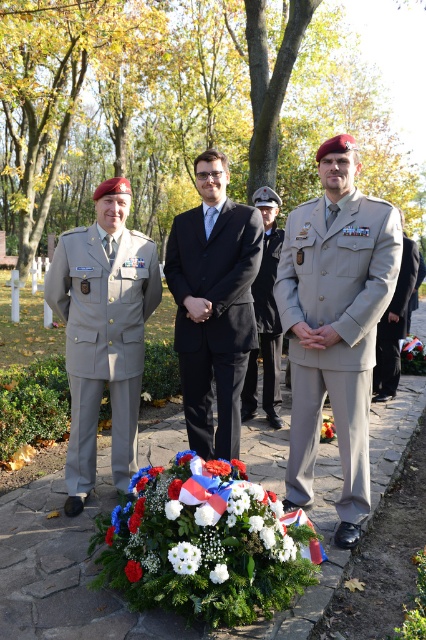
You are attending the ceremony and want to take a photo of both individuals marked by point (385, 340) and point (328, 419). Since you can only focus on one person at a time, which individual should you focus on to ensure the other is still in the background?

You should focus on point (328, 419) because point (385, 340) is behind it, so focusing on the closer person will keep the background person in view.

You are a photographer standing at the edge of the stone pathway where the white floral bouquet at center is placed. You want to take a closeup photo of the bouquet without moving any objects. Can you reach the bouquet from your current position?

The white floral bouquet at center is 2.41 meters from viewer, so yes, you can reach it from your current position as 2.41 meters is within a comfortable reaching distance for most people.

You are attending this ceremony and want to take a photo of both the satin black suit at center and the gray matte uniform at center. To ensure both are in the frame, should you position your camera to the left or right of the two individuals?

You should position your camera to the right of the two individuals because the satin black suit at center is to the left of the gray matte uniform at center, so placing the camera to the right would capture both in the frame.